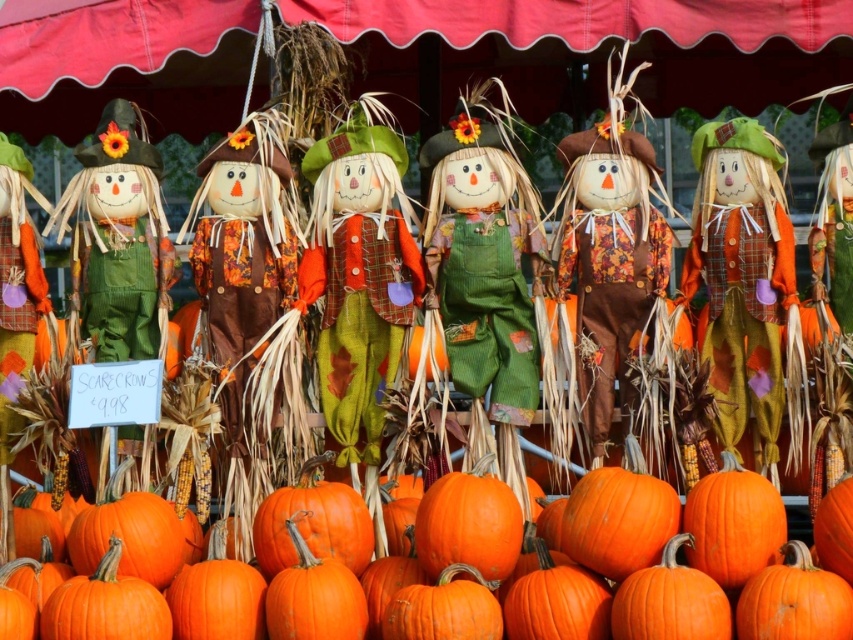
Question: Which object is the farthest from the matte green overalls at left?

Choices:
 (A) green corduroy scarecrow at center
 (B) matte orange fabric scarecrow at center
 (C) matte brown scarecrow at center

Answer: (B)

Question: Which object is closer to the camera taking this photo?

Choices:
 (A) orange matte pumpkin at center
 (B) matte green corduroy scarecrow at left

Answer: (A)

Question: Does matte plaid scarecrow at center lie behind matte green corduroy scarecrow at left?

Choices:
 (A) yes
 (B) no

Answer: (B)

Question: Can you confirm if green corduroy scarecrow at center is positioned to the right of matte orange fabric scarecrow at center?

Choices:
 (A) yes
 (B) no

Answer: (B)

Question: Is red fabric canopy at upper center to the left of matte orange scarecrow at center from the viewer's perspective?

Choices:
 (A) no
 (B) yes

Answer: (B)

Question: Which point appears closest to the camera in this image?

Choices:
 (A) (311, 221)
 (B) (107, 360)

Answer: (A)